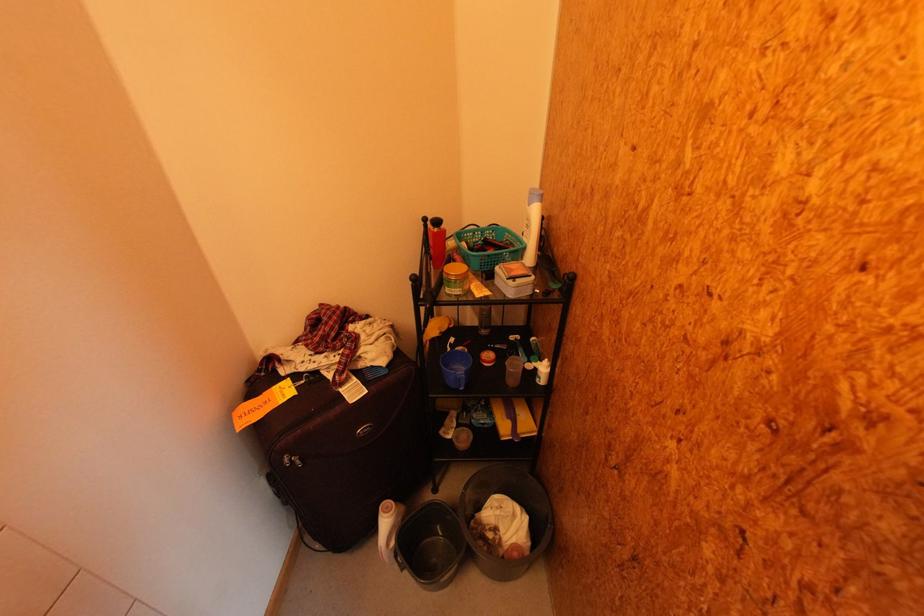
This screenshot has width=924, height=616. What do you see at coordinates (456, 367) in the screenshot?
I see `a blue cup handle` at bounding box center [456, 367].